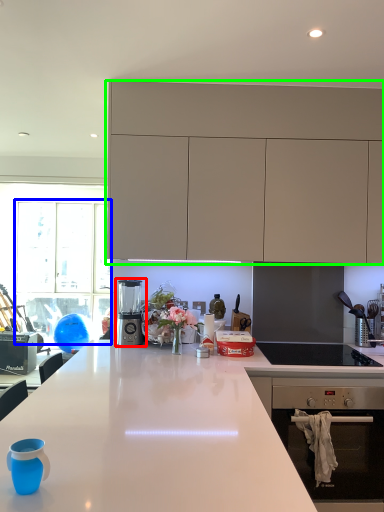
Question: Estimate the real-world distances between objects in this image. Which object is closer to kitchen appliance (highlighted by a red box), glass door (highlighted by a blue box) or cabinetry (highlighted by a green box)?

Choices:
 (A) glass door
 (B) cabinetry

Answer: (B)